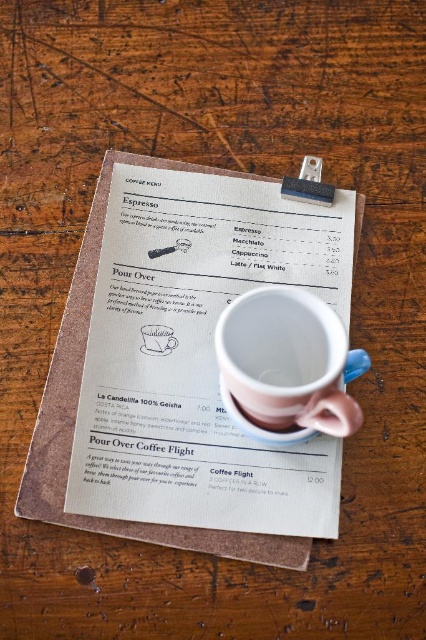
Is pink matte mug at center to the right of pink matte saucer at center from the viewer's perspective?

Incorrect, pink matte mug at center is not on the right side of pink matte saucer at center.

Consider the image. Does pink matte mug at center lie behind pink matte saucer at center?

Yes, pink matte mug at center is further from the viewer.

Describe the element at coordinates (158, 339) in the screenshot. I see `pink matte mug at center` at that location.

You are a GUI agent. You are given a task and a screenshot of the screen. Output one action in this format:
    pyautogui.click(x=<x>, y=<y>)
    Task: Click on the pink matte mug at center
    The width and height of the screenshot is (426, 640).
    Given the screenshot: What is the action you would take?
    pyautogui.click(x=158, y=339)

Measure the distance between point [256,310] and camera.

Point [256,310] is 56.74 centimeters from camera.

Consider the image. Does pink ceramic cup at center have a lesser width compared to pink matte saucer at center?

In fact, pink ceramic cup at center might be wider than pink matte saucer at center.

Where is `pink ceramic cup at center`? Image resolution: width=426 pixels, height=640 pixels. pink ceramic cup at center is located at coordinates (287, 365).

Can you confirm if white paper receipt at center is taller than pink matte saucer at center?

Indeed, white paper receipt at center has a greater height compared to pink matte saucer at center.

Where is `white paper receipt at center`? This screenshot has width=426, height=640. white paper receipt at center is located at coordinates (198, 355).